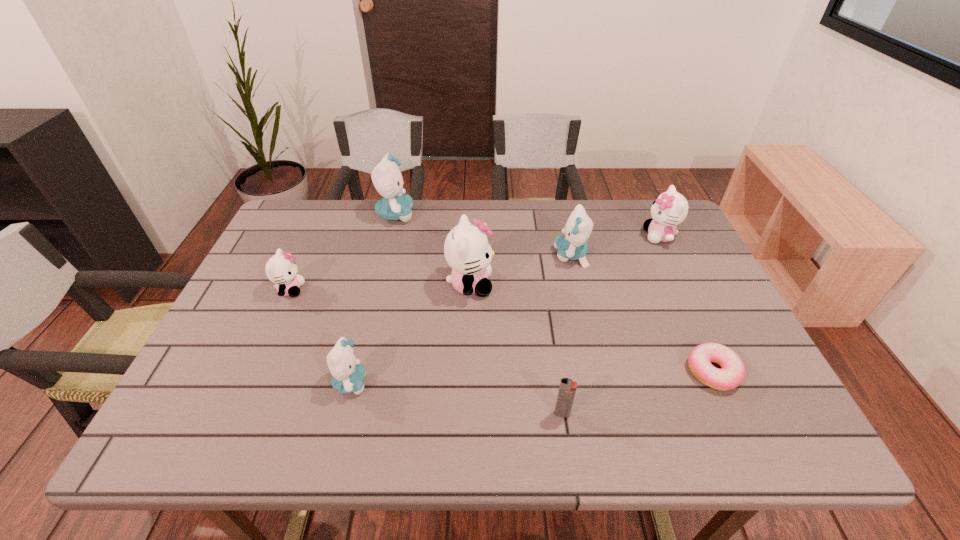
At what (x,y) coordinates should I click in order to perform the action: click on vacant space that satisfies the following two spatial constraints: 1. on the face of the igniter; 2. on the right side of the farthest blue kitten. Please return your answer as a coordinate pair (x, y). This screenshot has height=540, width=960. Looking at the image, I should click on (348, 414).

You are a GUI agent. You are given a task and a screenshot of the screen. Output one action in this format:
    pyautogui.click(x=<x>, y=<y>)
    Task: Click on the free spot that satisfies the following two spatial constraints: 1. on the face of the doughnut; 2. on the left side of the sixth object from left to right
    
    Given the screenshot: What is the action you would take?
    pyautogui.click(x=598, y=372)

Where is `free space in the image that satisfies the following two spatial constraints: 1. on the front-facing side of the doughnut; 2. on the right side of the biggest white kitten`? The width and height of the screenshot is (960, 540). free space in the image that satisfies the following two spatial constraints: 1. on the front-facing side of the doughnut; 2. on the right side of the biggest white kitten is located at coordinates (468, 372).

Identify the location of free space in the image that satisfies the following two spatial constraints: 1. on the face of the igniter; 2. on the right side of the smallest blue kitten. (343, 414).